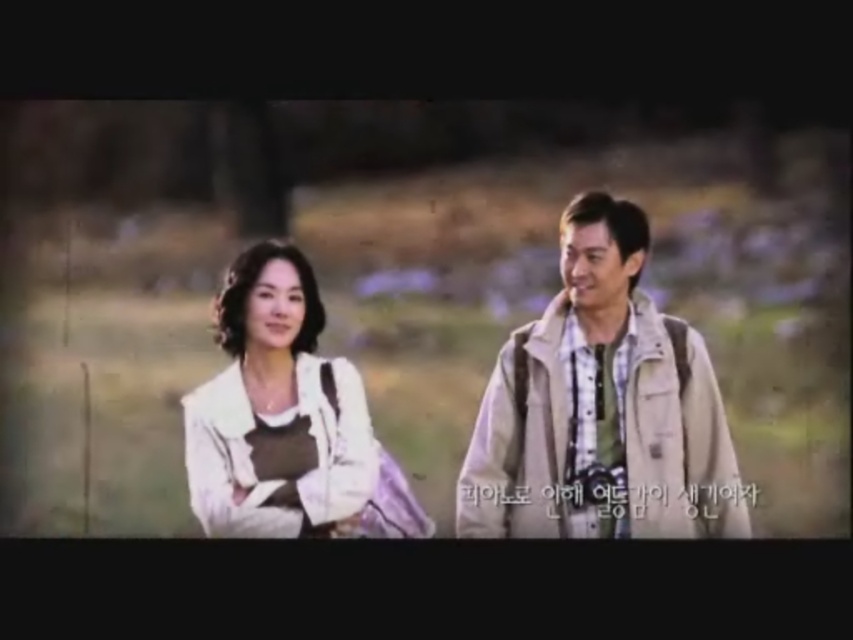
Question: From the image, what is the correct spatial relationship of beige canvas jacket at center in relation to white fabric jacket at left?

Choices:
 (A) right
 (B) left

Answer: (A)

Question: Which object appears closest to the camera in this image?

Choices:
 (A) beige canvas jacket at center
 (B) white fabric jacket at left

Answer: (B)

Question: Does beige canvas jacket at center have a lesser width compared to white fabric jacket at left?

Choices:
 (A) no
 (B) yes

Answer: (A)

Question: Can you confirm if beige canvas jacket at center is positioned above white fabric jacket at left?

Choices:
 (A) no
 (B) yes

Answer: (A)

Question: Among these points, which one is farthest from the camera?

Choices:
 (A) (729, 513)
 (B) (355, 378)

Answer: (B)

Question: Among these objects, which one is nearest to the camera?

Choices:
 (A) white fabric jacket at left
 (B) beige canvas jacket at center

Answer: (A)